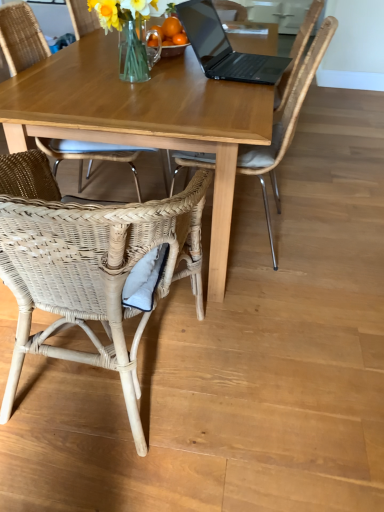
The width and height of the screenshot is (384, 512). Find the location of `vacant space in between woven rattan chair at upper center, the first chair when ordered from right to left, and wooden table at center`. vacant space in between woven rattan chair at upper center, the first chair when ordered from right to left, and wooden table at center is located at coordinates (277, 206).